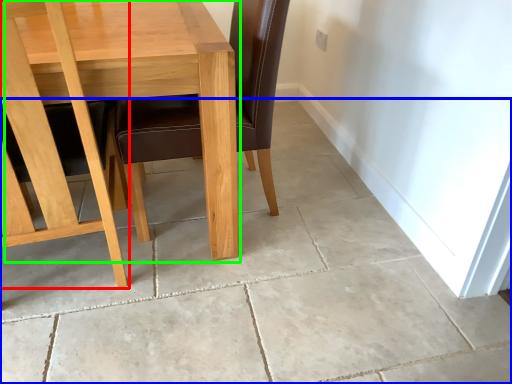
Question: Based on their relative distances, which object is nearer to chair (highlighted by a red box)? Choose from concrete (highlighted by a blue box) and table (highlighted by a green box).

Choices:
 (A) concrete
 (B) table

Answer: (B)